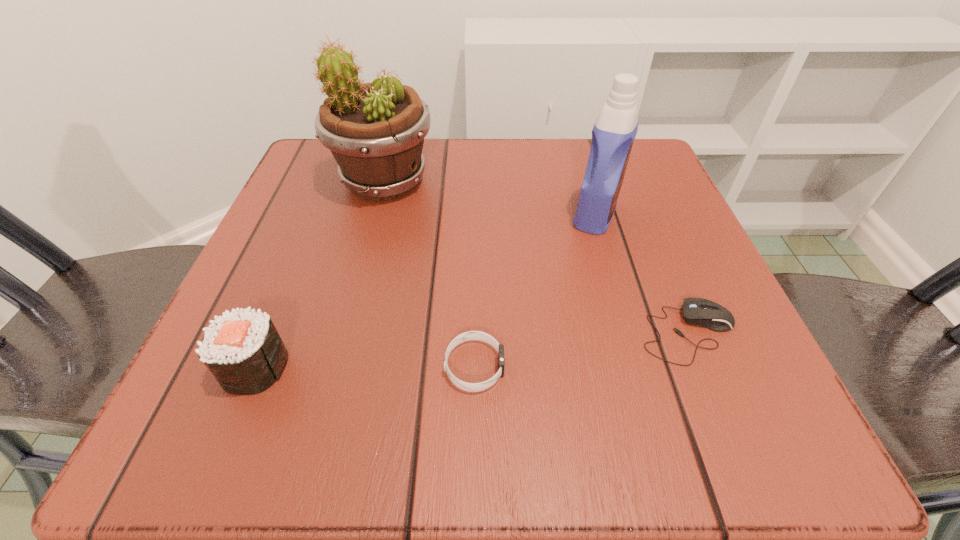
Image resolution: width=960 pixels, height=540 pixels. Identify the location of object located at the far right corner. (613, 134).

Where is `free space at the far edge`? The width and height of the screenshot is (960, 540). free space at the far edge is located at coordinates (497, 176).

This screenshot has width=960, height=540. I want to click on free location at the left edge, so click(x=350, y=239).

This screenshot has width=960, height=540. What are the coordinates of `vacant space at the right edge of the desktop` in the screenshot? It's located at (747, 356).

I want to click on free location at the far left corner of the desktop, so click(x=297, y=177).

This screenshot has width=960, height=540. In the image, there is a desktop. What are the coordinates of `free space at the far right corner` in the screenshot? It's located at (630, 187).

In the image, there is a desktop. At what (x,y) coordinates should I click in order to perform the action: click on vacant region at the near right corner. Please return your answer as a coordinate pair (x, y). Looking at the image, I should click on click(x=715, y=404).

Where is `free space that is in between the detergent and the third shortest object`? free space that is in between the detergent and the third shortest object is located at coordinates (425, 291).

The width and height of the screenshot is (960, 540). I want to click on vacant point located between the detergent and the third shortest object, so (425, 291).

Locate an element on the screen. This screenshot has height=540, width=960. unoccupied position between the flowerpot and the third tallest object is located at coordinates (320, 274).